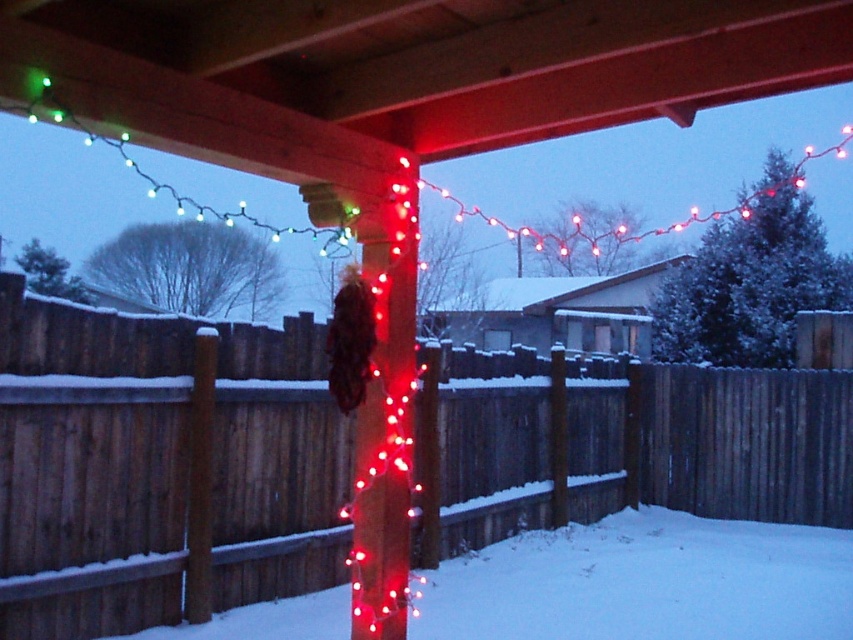
Does point (485, 540) come farther from viewer compared to point (740, 540)?

That is False.

Can you confirm if wooden fence at center is positioned above white powdery snow at center?

Correct, wooden fence at center is located above white powdery snow at center.

The width and height of the screenshot is (853, 640). In order to click on wooden fence at center in this screenshot , I will do `click(167, 445)`.